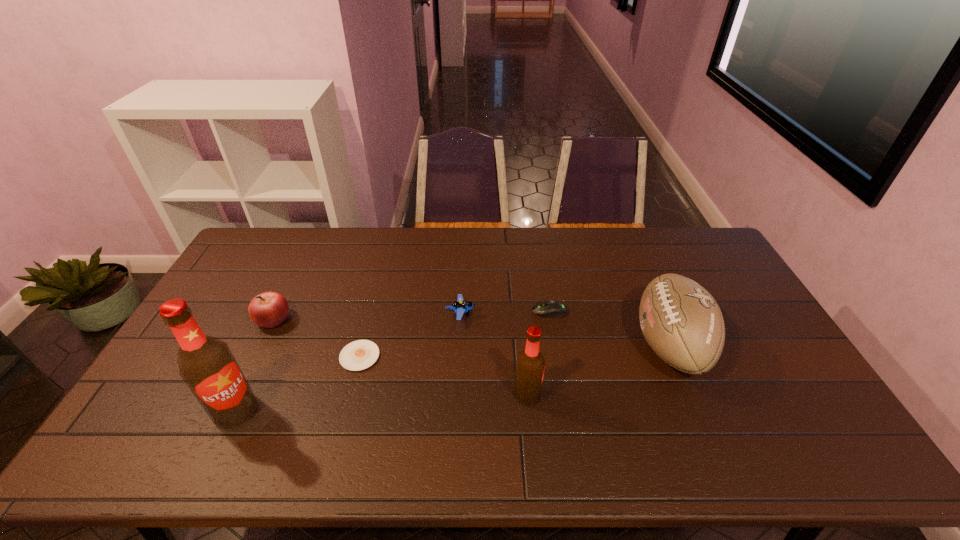
This screenshot has height=540, width=960. What are the coordinates of `vacant space situated 0.160m on the front of the fifth object from right to left` in the screenshot? It's located at (342, 424).

I want to click on vacant space located 0.160m on the wheel side of the second object from right to left, so point(482,311).

The image size is (960, 540). In order to click on vacant space located 0.270m on the wheel side of the second object from right to left in this screenshot , I will do `click(447, 311)`.

Where is `vacant space located on the wheel side of the second object from right to left`? This screenshot has width=960, height=540. vacant space located on the wheel side of the second object from right to left is located at coordinates (421, 311).

At what (x,y) coordinates should I click in order to perform the action: click on free space at the far edge of the desktop. Please return your answer as a coordinate pair (x, y). This screenshot has height=540, width=960. Looking at the image, I should click on (652, 249).

This screenshot has width=960, height=540. What are the coordinates of `vacant space at the left edge` in the screenshot? It's located at (271, 276).

Find the location of `vacant region at the right edge of the desktop`. vacant region at the right edge of the desktop is located at coordinates (768, 356).

You are a GUI agent. You are given a task and a screenshot of the screen. Output one action in this format:
    pyautogui.click(x=<x>, y=<y>)
    Task: Click on the vacant space at the far left corner of the desktop
    The width and height of the screenshot is (960, 540).
    Given the screenshot: What is the action you would take?
    pyautogui.click(x=256, y=253)

Where is `free space at the near left corner of the desktop`? Image resolution: width=960 pixels, height=540 pixels. free space at the near left corner of the desktop is located at coordinates (166, 418).

This screenshot has width=960, height=540. In order to click on free spot between the third object from left to right and the computer mouse in this screenshot , I will do `click(455, 334)`.